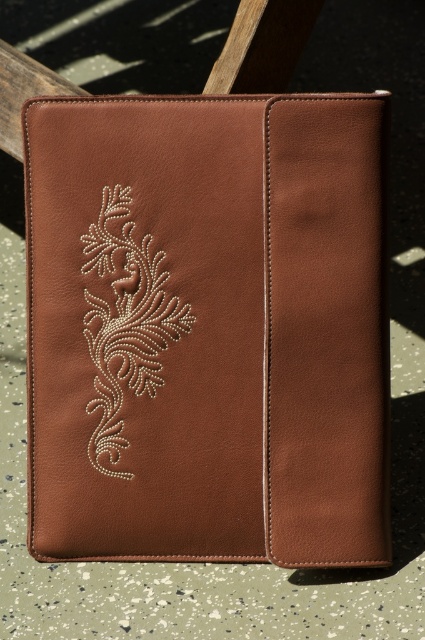
Does matte leather folder at center have a lesser height compared to white beaded floral design at center?

Incorrect, matte leather folder at center's height does not fall short of white beaded floral design at center's.

Is point (368, 148) positioned after point (153, 296)?

No, (368, 148) is in front of (153, 296).

This screenshot has height=640, width=425. I want to click on matte leather folder at center, so click(x=207, y=328).

Where is `matte leather folder at center`? matte leather folder at center is located at coordinates (207, 328).